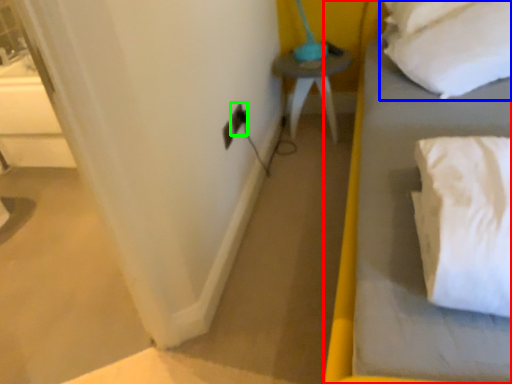
Question: Estimate the real-world distances between objects in this image. Which object is farther from bed (highlighted by a red box), pillow (highlighted by a blue box) or electric outlet (highlighted by a green box)?

Choices:
 (A) pillow
 (B) electric outlet

Answer: (B)